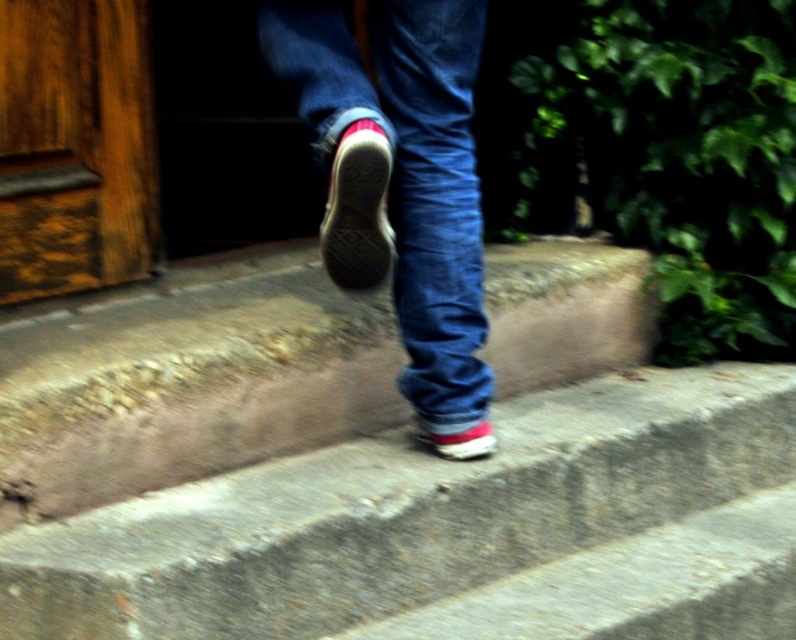
You are a tailor measuring the height of two items in the image. You need to determine which one is taller. Which object is taller between the denim at center and the shiny leather sneaker at center?

The denim at center is taller than the shiny leather sneaker at center according to the description.

You are a delivery robot with a wheel diameter of 0.3 meters. You need to move from the raised concrete surface to the lower one. The point where you will land is at point (431, 227). What is the minimum distance you must travel to reach the landing point?

The minimum distance you must travel to reach the landing point at point (431, 227) is 1.68 meters.